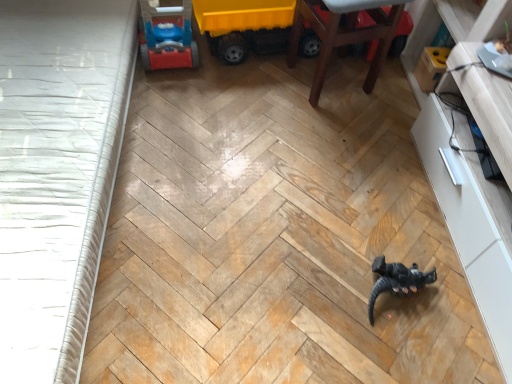
In order to click on free space between wooden chair at upper right and black matte dinosaur at center, the first toy positioned from the bottom in this screenshot , I will do `click(361, 171)`.